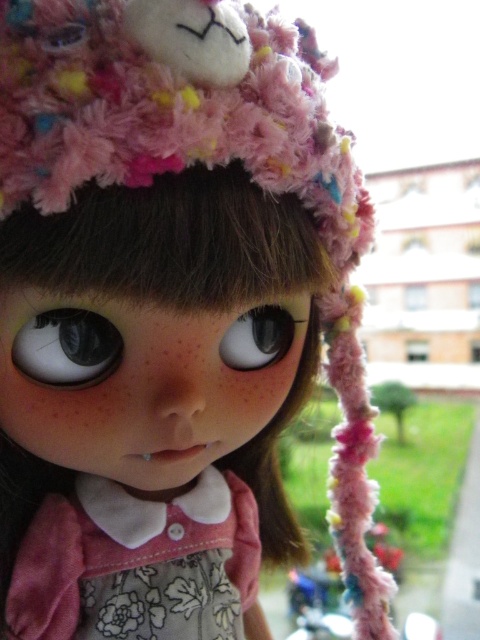
Can you confirm if floral fabric dress at center is taller than glossy plastic eye at center?

Indeed, floral fabric dress at center has a greater height compared to glossy plastic eye at center.

Find the location of `floral fabric dress at center`. floral fabric dress at center is located at coordinates (136, 563).

Does floral fabric dress at center appear on the right side of matte black eye at center?

Correct, you'll find floral fabric dress at center to the right of matte black eye at center.

Who is lower down, floral fabric dress at center or matte black eye at center?

Positioned lower is floral fabric dress at center.

Identify the location of floral fabric dress at center. (136, 563).

Does matte black eye at center come in front of glossy plastic eye at center?

Yes, matte black eye at center is closer to the viewer.

Between point (90, 364) and point (239, 352), which one is positioned in front?

Point (90, 364) is in front.

Does point (34, 330) come behind point (271, 333)?

No, (34, 330) is in front of (271, 333).

At what (x,y) coordinates should I click in order to perform the action: click on matte black eye at center. Please return your answer as a coordinate pair (x, y). Looking at the image, I should click on (67, 348).